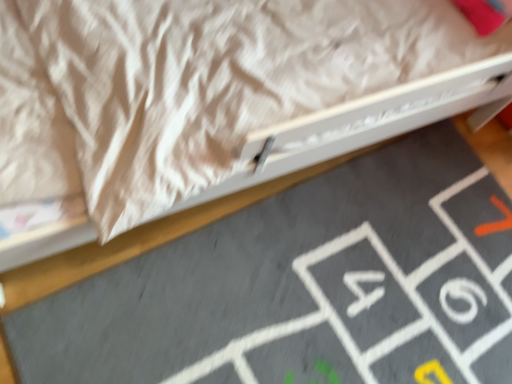
This screenshot has height=384, width=512. Identify the location of gray rubber doormat at center. (292, 284).

Describe the element at coordinates (292, 284) in the screenshot. Image resolution: width=512 pixels, height=384 pixels. I see `gray rubber doormat at center` at that location.

In order to click on gray rubber doormat at center in this screenshot , I will do `click(292, 284)`.